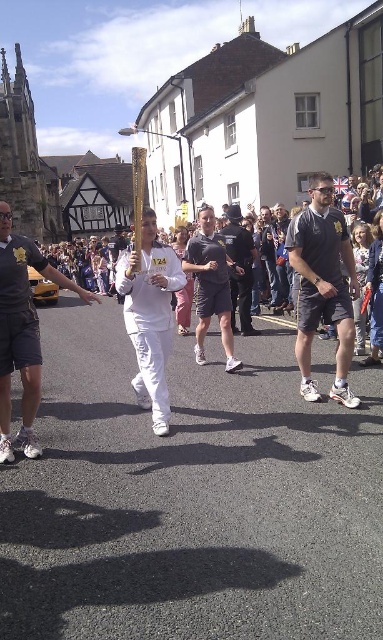
Question: Can you confirm if matte yellow shirt at left is positioned below white matte running suit at center?

Choices:
 (A) yes
 (B) no

Answer: (A)

Question: Which of the following is the closest to the observer?

Choices:
 (A) dark gray fabric shorts at center
 (B) dark gray shorts at center
 (C) black uniformed officer at center

Answer: (A)

Question: Which point appears farthest from the camera in this image?

Choices:
 (A) (314, 208)
 (B) (232, 259)
 (C) (21, 428)
 (D) (142, 216)

Answer: (B)

Question: Which object is closer to the camera taking this photo?

Choices:
 (A) white matte running suit at center
 (B) dark gray shorts at center
 (C) dark gray fabric shorts at center

Answer: (A)

Question: Is matte yellow shirt at left smaller than white matte running suit at center?

Choices:
 (A) yes
 (B) no

Answer: (B)

Question: Is dark gray fabric shorts at center wider than white matte running suit at center?

Choices:
 (A) no
 (B) yes

Answer: (B)